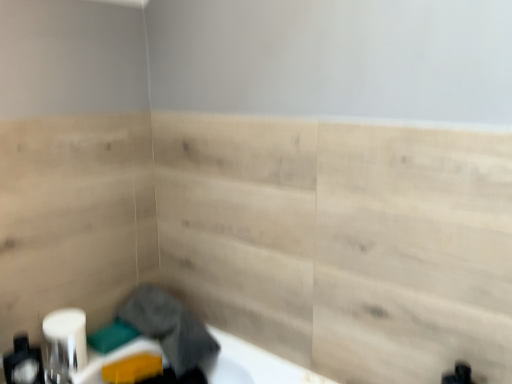
Question: Considering the positions of matte white soap dispenser at lower left and white glossy toilet paper at lower left in the image, is matte white soap dispenser at lower left wider or thinner than white glossy toilet paper at lower left?

Choices:
 (A) wide
 (B) thin

Answer: (A)

Question: From their relative heights in the image, would you say matte white soap dispenser at lower left is taller or shorter than white glossy toilet paper at lower left?

Choices:
 (A) tall
 (B) short

Answer: (A)

Question: Which of these objects is positioned closest to the matte white soap dispenser at lower left?

Choices:
 (A) natural wood paneling at center
 (B) white glossy toilet paper at lower left
 (C) gray fabric at lower left

Answer: (B)

Question: Based on their relative distances, which object is nearer to the matte white soap dispenser at lower left?

Choices:
 (A) white glossy toilet paper at lower left
 (B) gray fabric at lower left
 (C) natural wood paneling at center

Answer: (A)